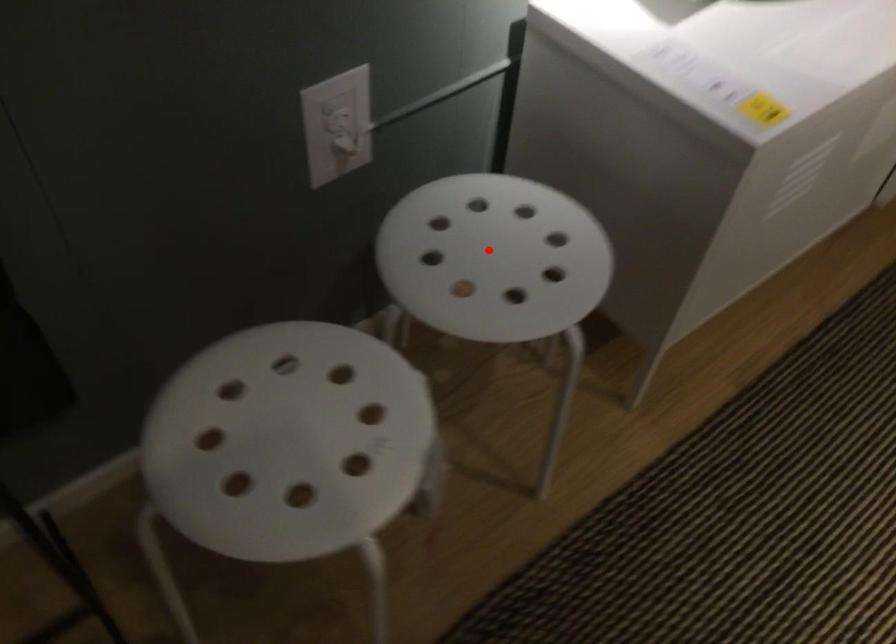
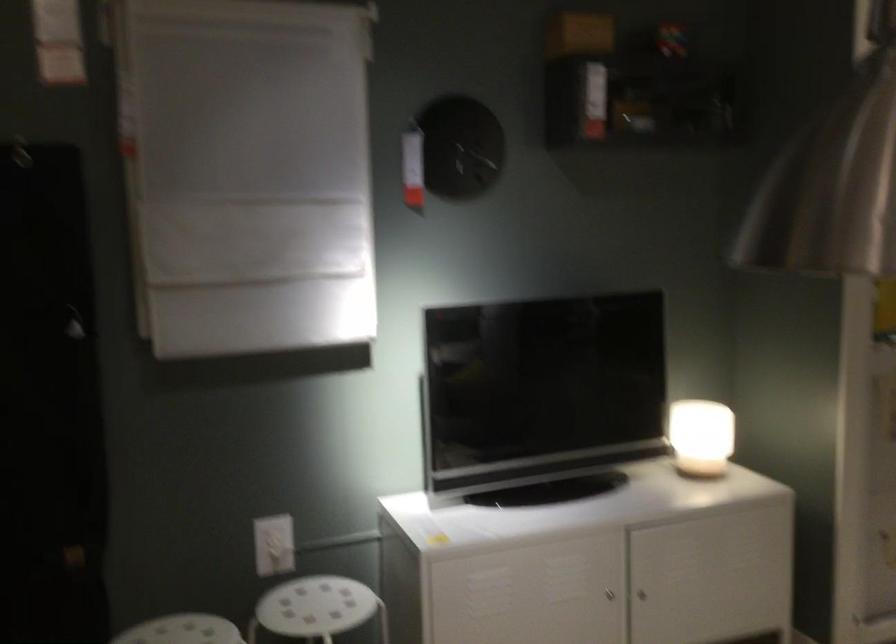
Question: I am providing you with two images of the same scene from different viewpoints. Given a red point in image1, look at the same physical point in image2. Is it:

Choices:
 (A) Closer to the viewpoint
 (B) Farther from the viewpoint

Answer: (B)